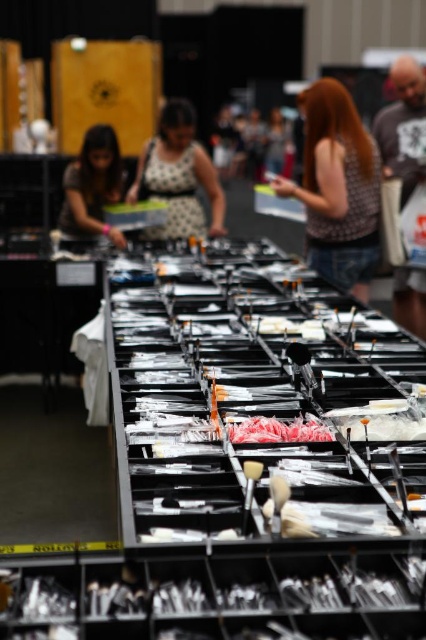
How much distance is there between plaid shirt at upper center and pink glossy candy at center?

A distance of 2.58 meters exists between plaid shirt at upper center and pink glossy candy at center.

Is plaid shirt at upper center to the right of pink glossy candy at center from the viewer's perspective?

Indeed, plaid shirt at upper center is positioned on the right side of pink glossy candy at center.

Between point (325, 266) and point (282, 429), which one is positioned in front?

Point (282, 429) is in front.

At what (x,y) coordinates should I click in order to perform the action: click on plaid shirt at upper center. Please return your answer as a coordinate pair (x, y). This screenshot has width=426, height=640. Looking at the image, I should click on (337, 188).

Is bald man at upper right to the right of matte black laptop at left from the viewer's perspective?

Correct, you'll find bald man at upper right to the right of matte black laptop at left.

Is point (397, 136) closer to camera compared to point (118, 182)?

No, (397, 136) is behind (118, 182).

Find the location of a particular element. This screenshot has height=640, width=426. bald man at upper right is located at coordinates (403, 124).

Can you confirm if plaid shirt at upper center is bigger than matte black laptop at left?

Yes.

Between plaid shirt at upper center and matte black laptop at left, which one appears on the right side from the viewer's perspective?

Positioned to the right is plaid shirt at upper center.

Which is behind, point (322, 170) or point (100, 230)?

Point (100, 230)

This screenshot has width=426, height=640. I want to click on plaid shirt at upper center, so click(x=337, y=188).